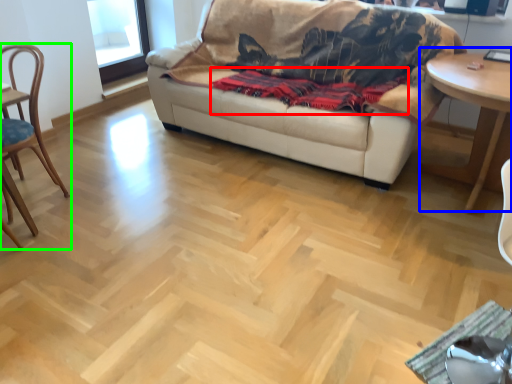
Question: Based on their relative distances, which object is farther from blanket (highlighted by a red box)? Choose from table (highlighted by a blue box) and chair (highlighted by a green box).

Choices:
 (A) table
 (B) chair

Answer: (B)